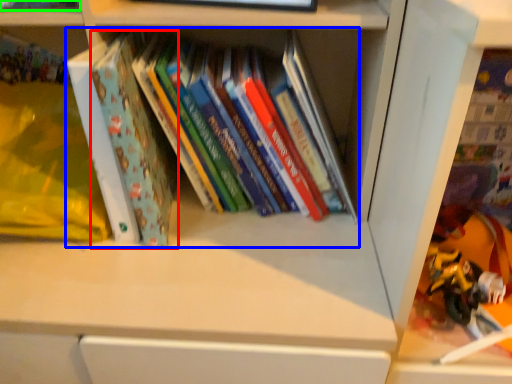
Question: Which object is the farthest from paperback book (highlighted by a red box)? Choose among these: book (highlighted by a blue box) or book (highlighted by a green box).

Choices:
 (A) book
 (B) book

Answer: (B)